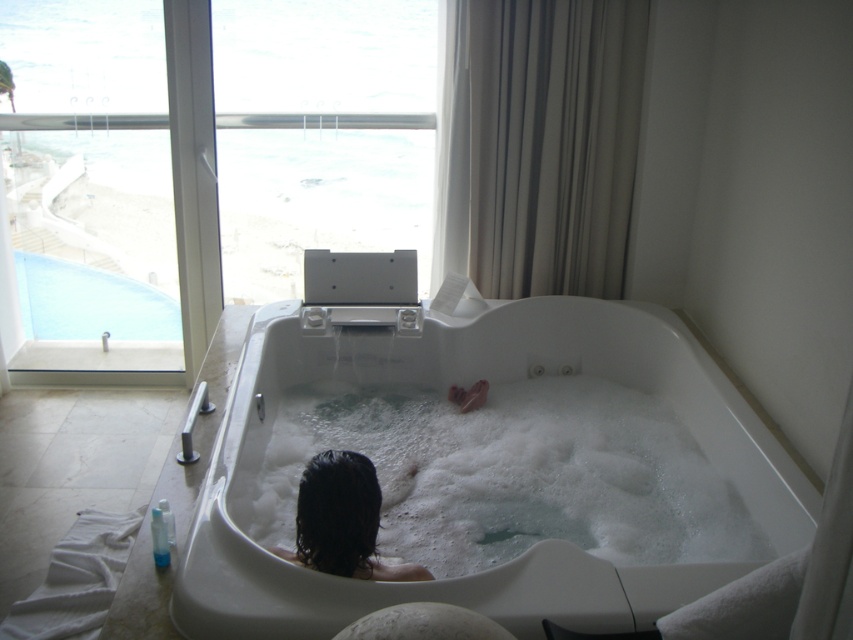
You are a delivery robot that needs to deliver a package to the bathroom. The package is 8 inches wide. There is a narrow passage between the transparent glass door at upper left and the transparent glass window at upper center. Can you fit through this passage with the package?

The passage between the transparent glass door at upper left and the transparent glass window at upper center is 7.06 inches wide. Since the package is 8 inches wide, it is wider than the available space. Therefore, the delivery robot cannot fit through the passage with the package.

You are a home inspector assessing the bathroom layout. You need to ensure there is enough space between the white glossy jacuzzi at center and the white foamy bath at center for a maintenance worker to safely access both. The worker requires at least 10 inches of clearance. Is the current spacing sufficient?

The distance between the white glossy jacuzzi at center and the white foamy bath at center is 9.75 inches, which is slightly less than the required 10 inches. Therefore, the current spacing is insufficient for the maintenance worker to safely access both.